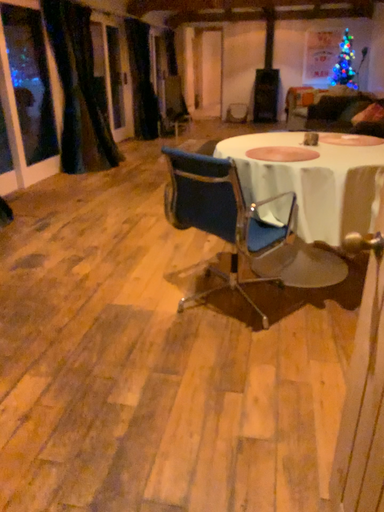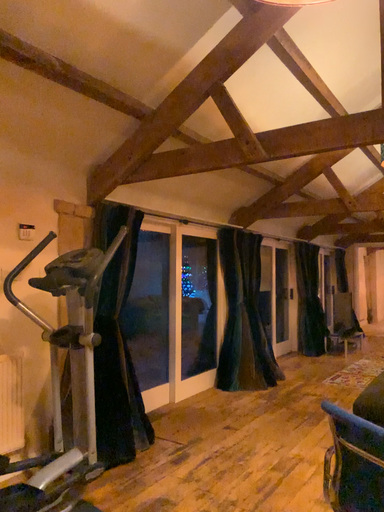
Question: How did the camera likely rotate when shooting the video?

Choices:
 (A) rotated left
 (B) rotated right

Answer: (A)